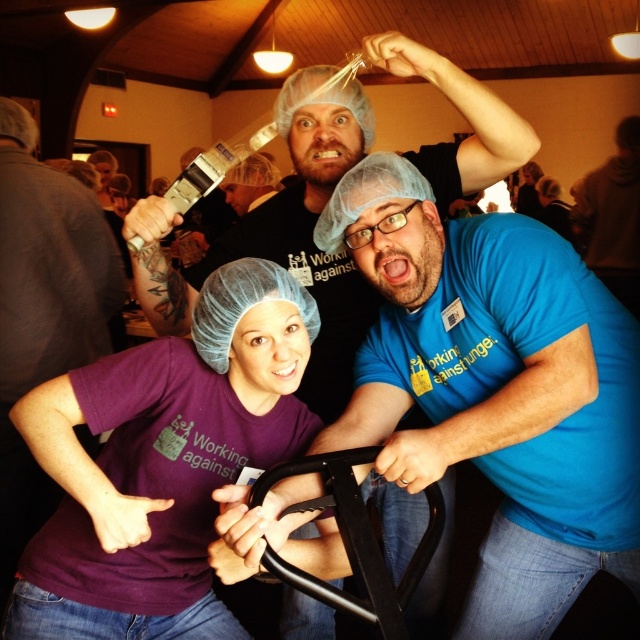
Question: Considering the real-world distances, which object is closest to the purple fabric shirt at left?

Choices:
 (A) purple matte shirt at center
 (B) blue matte shirt at center

Answer: (A)

Question: Among these objects, which one is nearest to the camera?

Choices:
 (A) purple fabric shirt at left
 (B) blue matte shirt at center

Answer: (B)

Question: Considering the relative positions of blue matte shirt at center and purple matte shirt at center in the image provided, where is blue matte shirt at center located with respect to purple matte shirt at center?

Choices:
 (A) below
 (B) above

Answer: (B)

Question: Which of the following is the farthest from the observer?

Choices:
 (A) purple matte shirt at center
 (B) blue matte shirt at center
 (C) purple fabric shirt at left

Answer: (C)

Question: Does purple matte shirt at center have a smaller size compared to purple fabric shirt at left?

Choices:
 (A) yes
 (B) no

Answer: (A)

Question: Is blue matte shirt at center closer to camera compared to purple matte shirt at center?

Choices:
 (A) yes
 (B) no

Answer: (A)